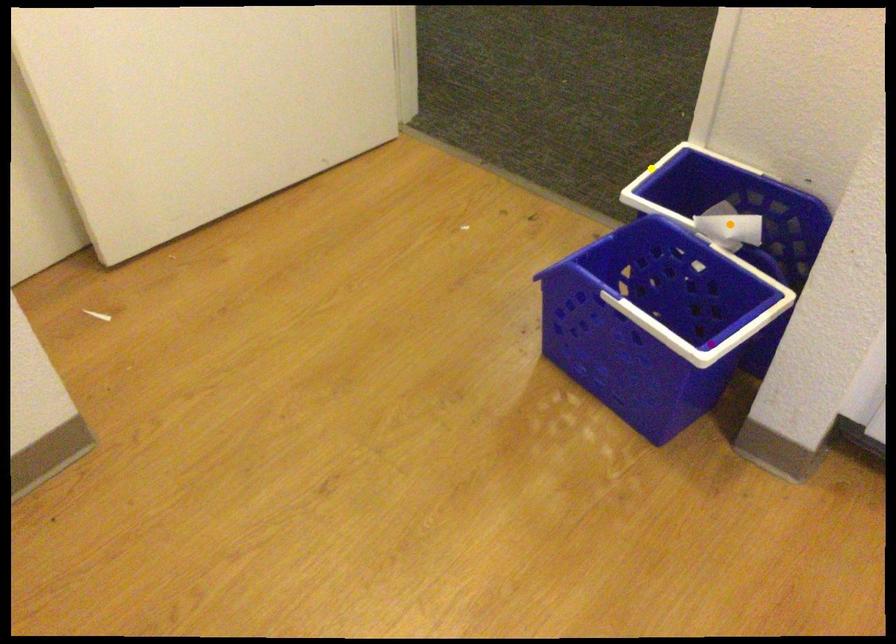
Order these from nearest to farthest:
- orange point
- yellow point
- purple point

1. yellow point
2. orange point
3. purple point